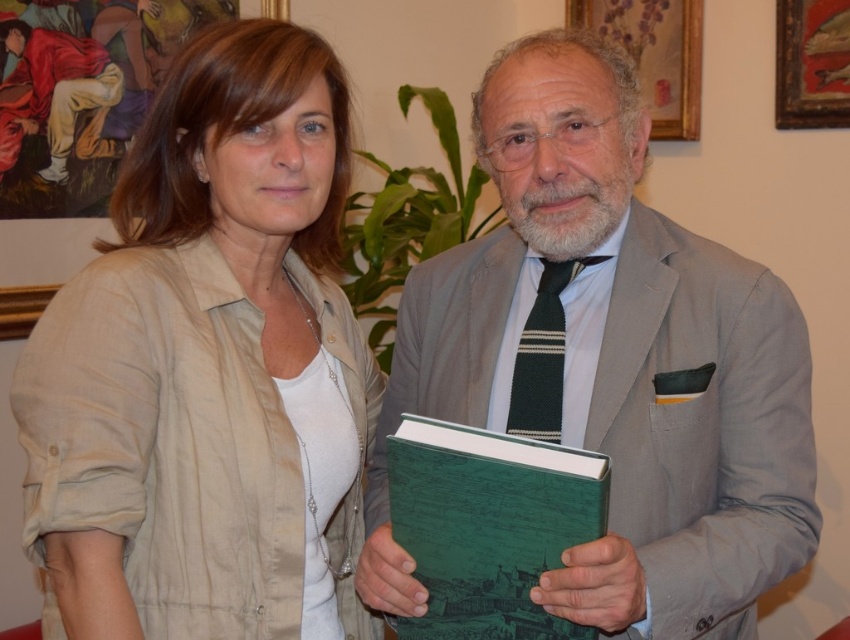
This screenshot has height=640, width=850. Describe the element at coordinates (488, 525) in the screenshot. I see `green matte book at center` at that location.

Can you confirm if green matte book at center is positioned below wooden frame at upper center?

Yes.

Is point (480, 524) behind point (670, 97)?

No, it is in front of (670, 97).

You are a GUI agent. You are given a task and a screenshot of the screen. Output one action in this format:
    pyautogui.click(x=<x>, y=<y>)
    Task: Click on the green matte book at center
    This screenshot has height=640, width=850.
    Given the screenshot: What is the action you would take?
    pyautogui.click(x=488, y=525)

Does beige linen shirt at left have a lesser width compared to gray wool suit at center?

Correct, beige linen shirt at left's width is less than gray wool suit at center's.

Which is in front, point (174, 563) or point (729, 509)?

Point (174, 563) is more forward.

Find the location of a particular element. The width and height of the screenshot is (850, 640). beige linen shirt at left is located at coordinates (208, 369).

Who is more distant from viewer, [20,378] or [791,100]?

The point [791,100] is behind.

Does beige linen shirt at left have a lesser width compared to wooden frame at upper right?

A: No.

Describe the element at coordinates (208, 369) in the screenshot. I see `beige linen shirt at left` at that location.

The height and width of the screenshot is (640, 850). Identify the location of beige linen shirt at left. (208, 369).